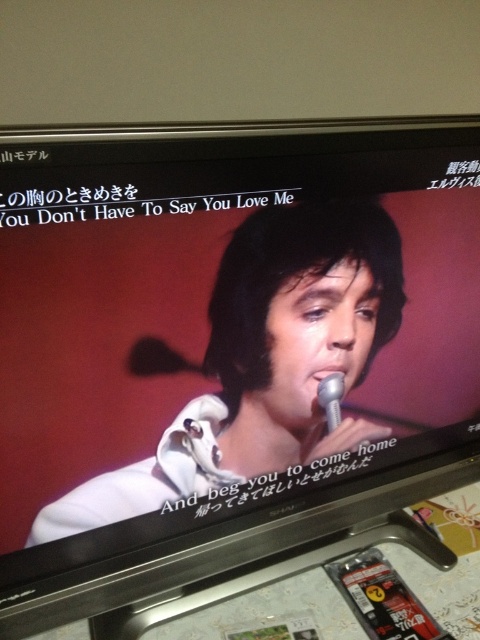
Is point (212, 371) positioned in front of point (320, 396)?

Yes.

Can you confirm if white matte jacket at center is shorter than metallic silver microphone at center?

No, white matte jacket at center is not shorter than metallic silver microphone at center.

This screenshot has height=640, width=480. I want to click on white matte jacket at center, so [265, 360].